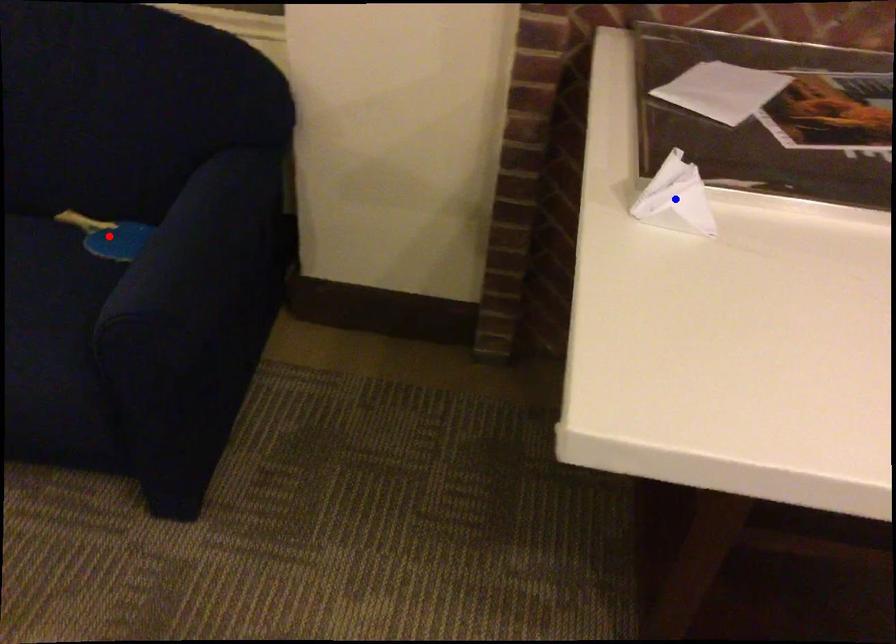
Question: Two points are marked on the image. Which point is closer to the camera?

Choices:
 (A) Blue point is closer.
 (B) Red point is closer.

Answer: (A)